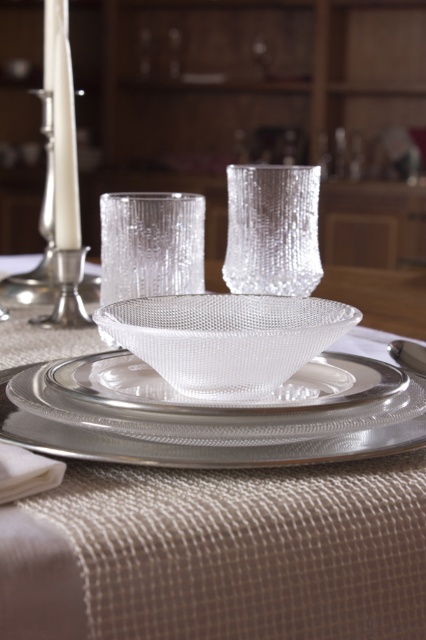
Question: Does satin glass bowl at center have a larger size compared to clear textured glass at center?

Choices:
 (A) no
 (B) yes

Answer: (B)

Question: Which point appears closest to the camera in this image?

Choices:
 (A) (92, 360)
 (B) (181, 244)
 (C) (3, 349)
 (D) (55, 387)

Answer: (D)

Question: Which is farther from the satin glass bowl at center?

Choices:
 (A) satin silver platter at center
 (B) satin silver saucer at center
 (C) clear textured glass at center

Answer: (C)

Question: Among these points, which one is farthest from the camera?

Choices:
 (A) (189, 241)
 (B) (379, 392)

Answer: (A)

Question: Is satin silver platter at center closer to the viewer compared to satin silver saucer at center?

Choices:
 (A) no
 (B) yes

Answer: (B)

Question: Can you confirm if satin glass bowl at center is positioned to the left of clear textured glass at center?

Choices:
 (A) no
 (B) yes

Answer: (A)